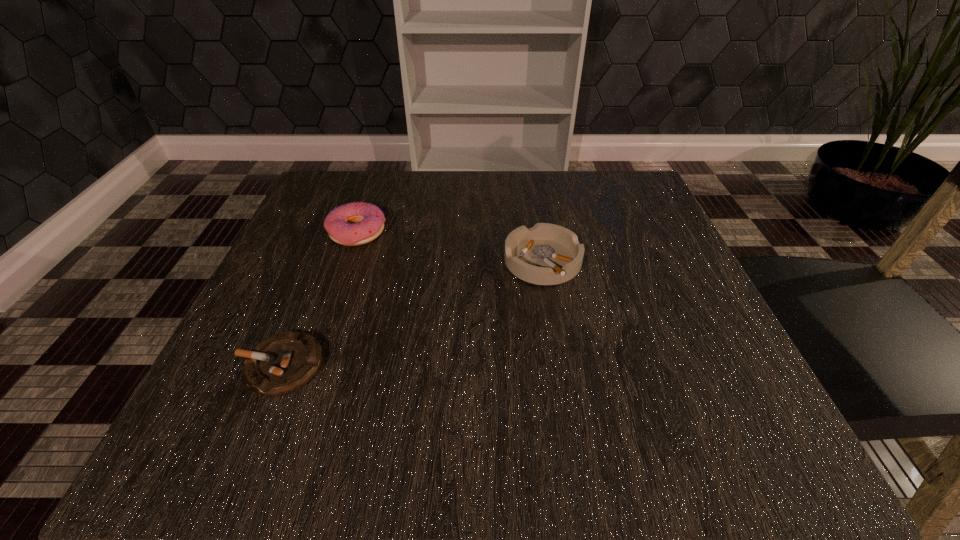
This screenshot has height=540, width=960. I want to click on doughnut, so click(x=352, y=224).

This screenshot has height=540, width=960. Find the location of `the right ashtray`. the right ashtray is located at coordinates pos(547,254).

Where is `the rightmost object`? The height and width of the screenshot is (540, 960). the rightmost object is located at coordinates (547, 254).

The image size is (960, 540). In order to click on the nearest object in this screenshot , I will do `click(282, 363)`.

In order to click on the shortest object in this screenshot , I will do `click(282, 363)`.

Locate an element on the screen. free spot located on the right of the doughnut is located at coordinates (576, 233).

This screenshot has width=960, height=540. In order to click on blank space located 0.210m on the front of the taller ashtray in this screenshot , I will do `click(564, 396)`.

The height and width of the screenshot is (540, 960). Identify the location of free space located on the right of the nearer ashtray. (467, 366).

The width and height of the screenshot is (960, 540). I want to click on object that is at the far edge, so click(x=352, y=224).

Image resolution: width=960 pixels, height=540 pixels. In order to click on doughnut that is at the left edge in this screenshot , I will do `click(352, 224)`.